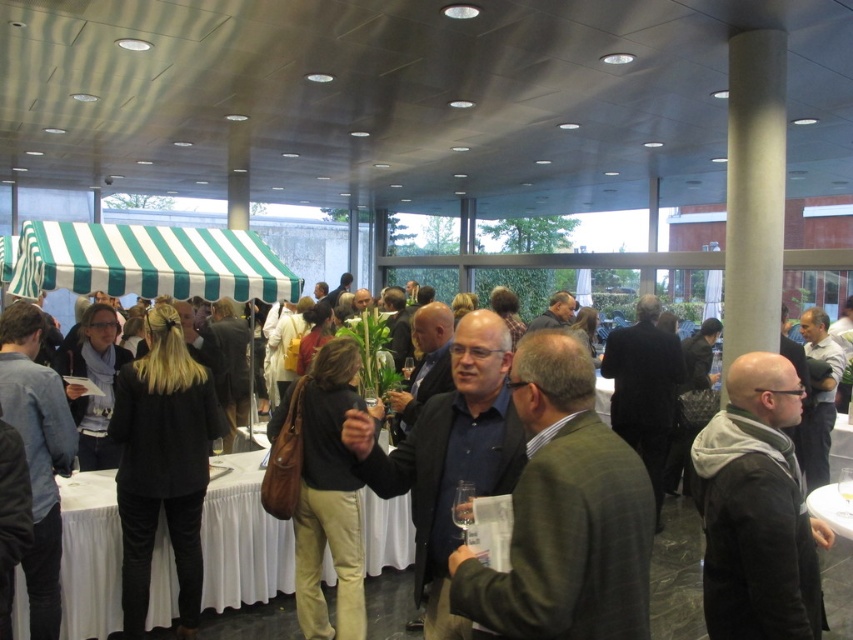
You are at the entrance of the event venue and see the black fabric coat at center. If you walk straight ahead, will you approach the coat or move away from it?

Since the black fabric coat at center is located at point (161, 465), walking straight ahead from the entrance would move you closer to the coat, so you will approach it.

You are an event planner arranging seating for an upcoming talk. You need to place a chair between the dark brown leather jacket at center and the black fabric coat at center. Which side of the chair should face the front of the room to ensure it aligns with the existing arrangement?

The dark brown leather jacket at center is to the right of the black fabric coat at center. To align with the existing arrangement, the chair should face the front of the room such that it is positioned between them, with the front of the room direction consistent with how the coats are oriented relative to each other.